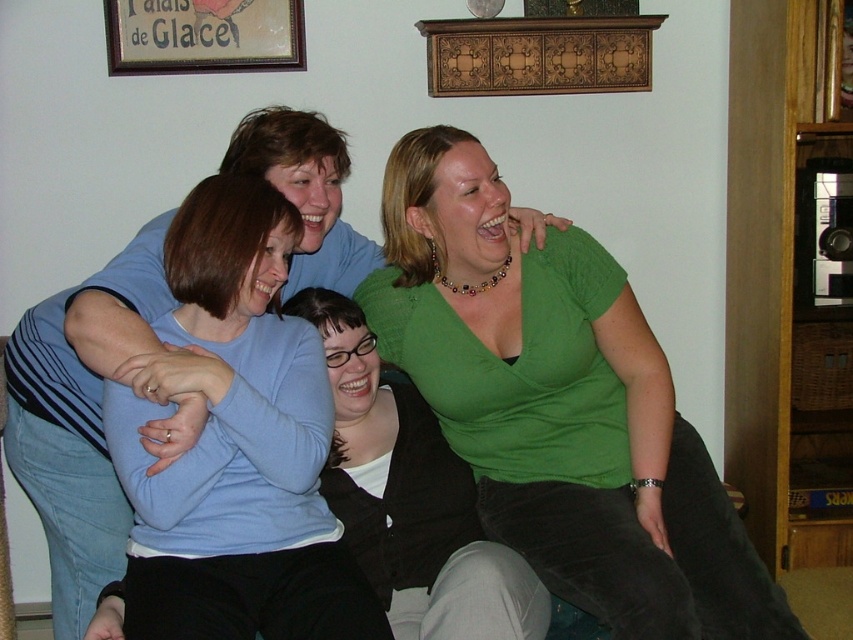
Which is more to the left, green matte shirt at center or wooden frame at upper center?

Positioned to the left is wooden frame at upper center.

Can you confirm if green matte shirt at center is wider than wooden frame at upper center?

Yes.

Which is behind, point (338, 483) or point (136, 20)?

Positioned behind is point (136, 20).

At what (x,y) coordinates should I click in order to perform the action: click on green matte shirt at center. Please return your answer as a coordinate pair (x, y). The height and width of the screenshot is (640, 853). Looking at the image, I should click on (410, 499).

Is green matte shirt at upper right below matte blue sweater at center?

Yes.

Can you confirm if green matte shirt at upper right is shorter than matte blue sweater at center?

In fact, green matte shirt at upper right may be taller than matte blue sweater at center.

The height and width of the screenshot is (640, 853). In order to click on green matte shirt at upper right in this screenshot , I will do `click(560, 404)`.

This screenshot has width=853, height=640. Identify the location of matte blue sweater at center. (238, 445).

Between matte blue sweater at center and green matte shirt at center, which one is positioned lower?

green matte shirt at center

Is point (341, 625) behind point (427, 611)?

No, (341, 625) is in front of (427, 611).

Where is `matte blue sweater at center`? This screenshot has width=853, height=640. matte blue sweater at center is located at coordinates (238, 445).